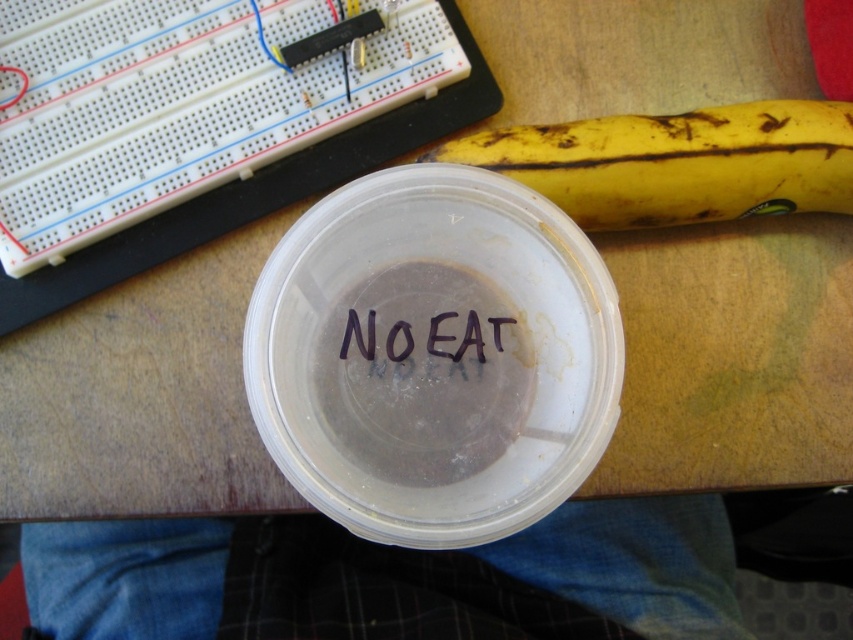
Consider the image. You are an office worker who needs to place a sticky note on the wooden surface. You have a sticky note that is 3 inches wide. You see the yellow matte banana at upper right and the black ink writing at center. Which object can the sticky note fit over without overlapping?

The sticky note that is 3 inches wide can fit over the black ink writing at center since the yellow matte banana at upper right is wider than the black ink writing at center.

You are a delivery robot that needs to place a package on the workspace. The package is 25 inches long. You see the yellow matte banana at upper right. Is there enough space between you and the banana to place the package?

The distance between you and the yellow matte banana at upper right is 25.62 inches, which is slightly longer than the package length of 25 inches. Therefore, there is enough space to place the package between you and the yellow matte banana at upper right.

You are organizing the workspace and need to place the yellow matte banana at upper right and the black ink writing at center into a box that can only hold items within 15 centimeters of each other. Can both items fit in the box together?

The yellow matte banana at upper right and the black ink writing at center are 17.82 centimeters apart, which exceeds the 15 centimeter limit. Therefore, both items cannot fit in the box together.